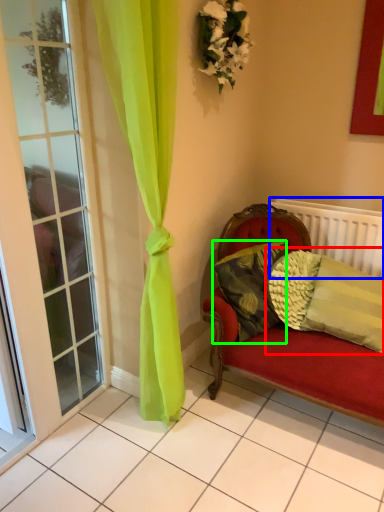
Question: Considering the real-world distances, which object is farthest from pillow (highlighted by a red box)? radiator (highlighted by a blue box) or pillow (highlighted by a green box)?

Choices:
 (A) radiator
 (B) pillow

Answer: (A)